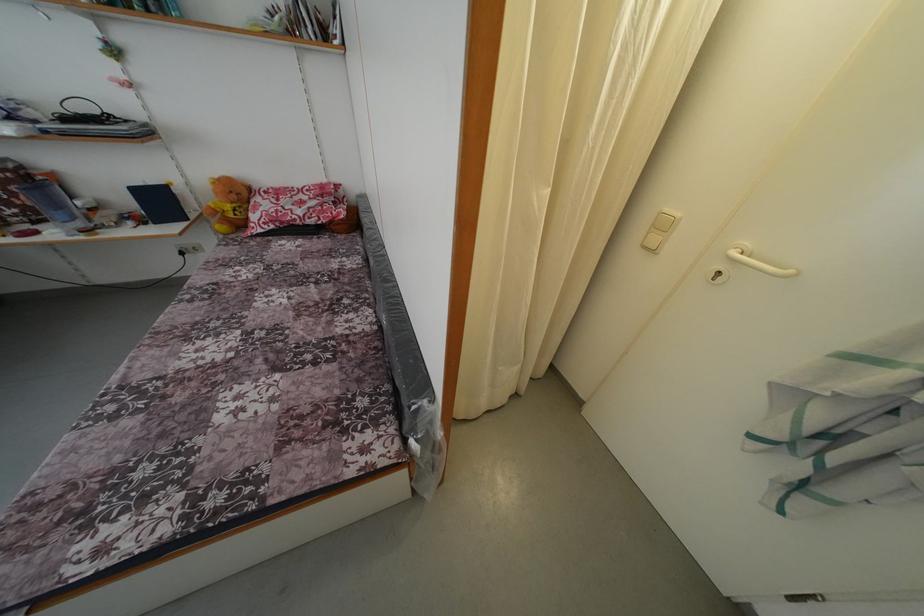
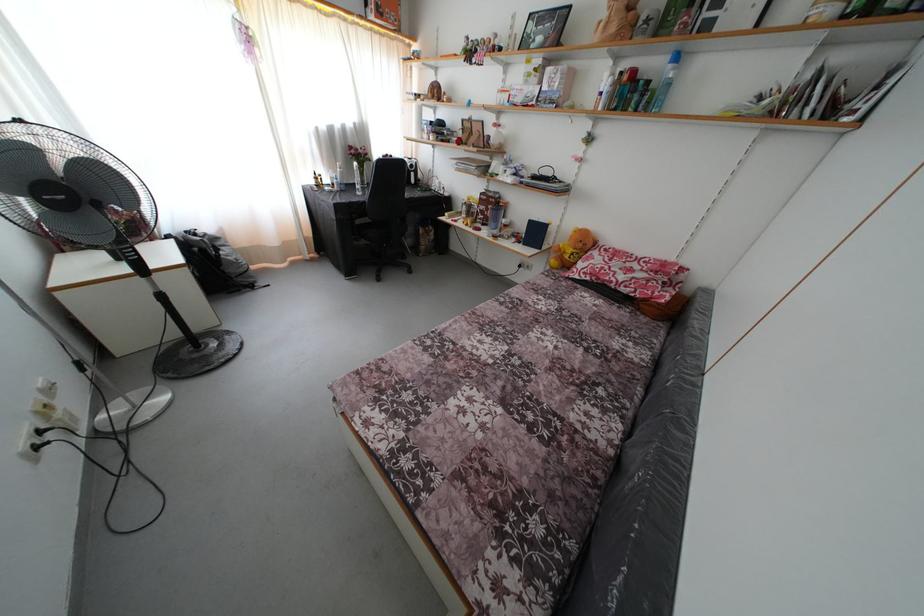
Locate, in the second image, the point that corresponds to the point at 41,228 in the first image.

(488, 230)